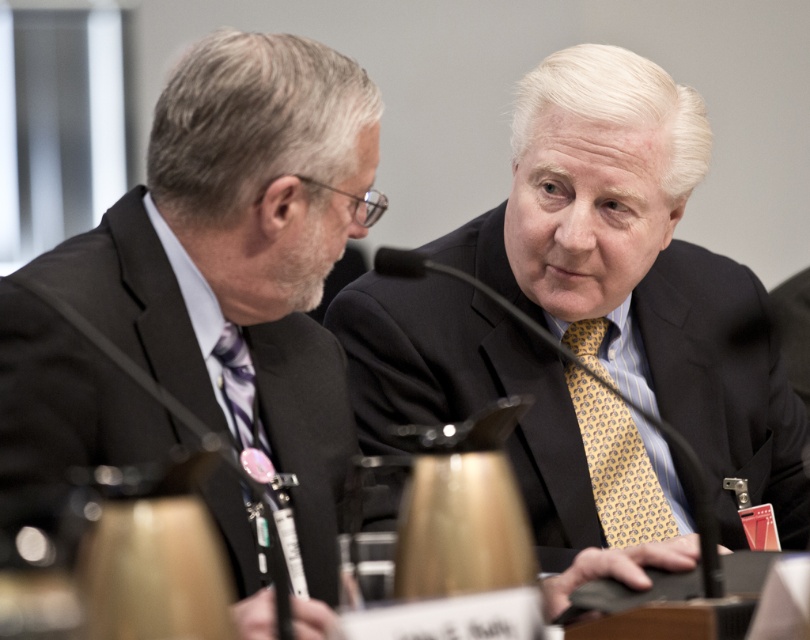
Question: Can you confirm if yellowpatterned fabrictie at center is positioned to the right of patterned silk tie at left?

Choices:
 (A) no
 (B) yes

Answer: (B)

Question: Is matte black suit at center in front of yellowpatterned fabrictie at center?

Choices:
 (A) no
 (B) yes

Answer: (B)

Question: Estimate the real-world distances between objects in this image. Which object is closer to the matte black suit at left?

Choices:
 (A) patterned silk tie at left
 (B) yellowpatterned fabrictie at center

Answer: (A)

Question: Which object appears farthest from the camera in this image?

Choices:
 (A) matte black suit at left
 (B) yellowpatterned fabrictie at center

Answer: (B)

Question: Does matte black suit at left appear on the right side of yellowpatterned fabrictie at center?

Choices:
 (A) no
 (B) yes

Answer: (A)

Question: Which point is farther to the camera?

Choices:
 (A) matte black suit at center
 (B) yellowpatterned fabrictie at center
 (C) matte black suit at left
 (D) patterned silk tie at left

Answer: (B)